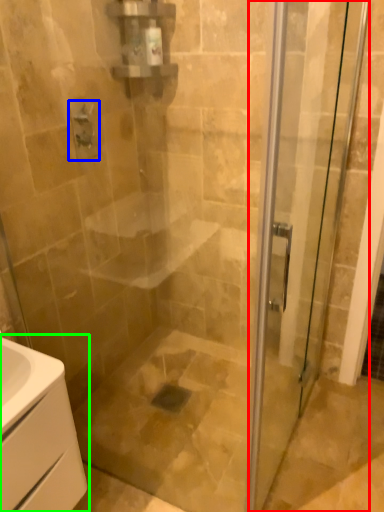
Question: Which object is positioned closest to door (highlighted by a red box)? Select from shower (highlighted by a blue box) and bathroom cabinet (highlighted by a green box).

Choices:
 (A) shower
 (B) bathroom cabinet

Answer: (B)